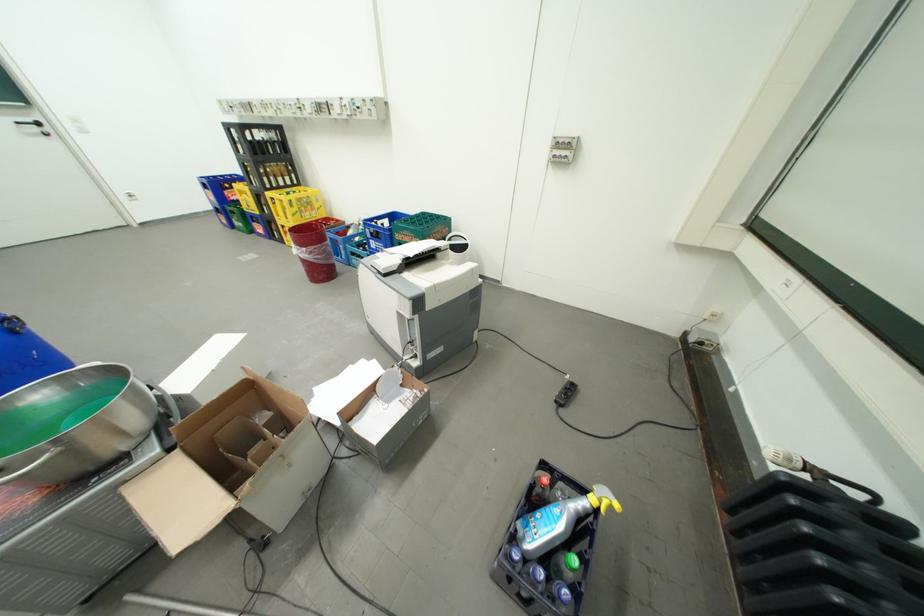
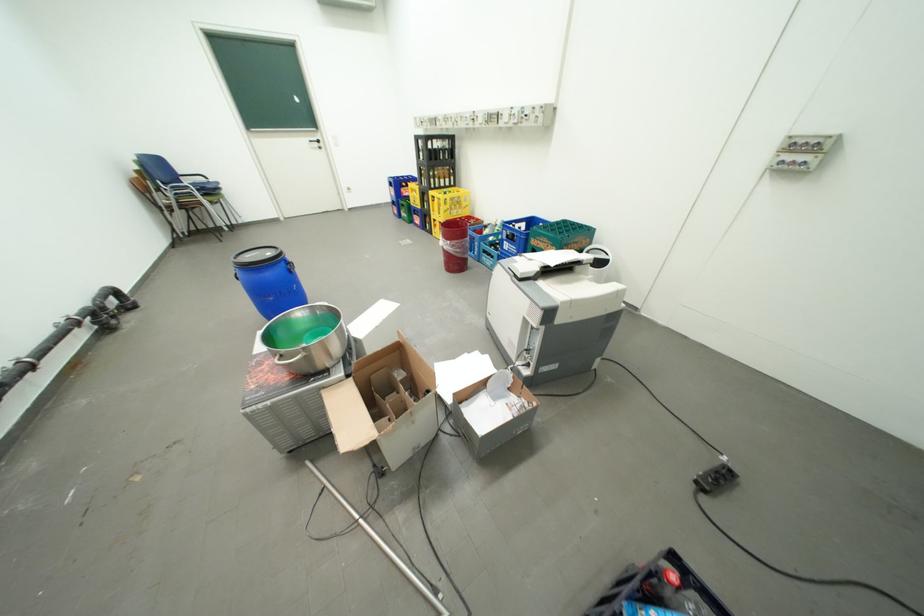
The point at (x=310, y=215) is marked in the first image. Where is the corresponding point in the second image?

(459, 212)